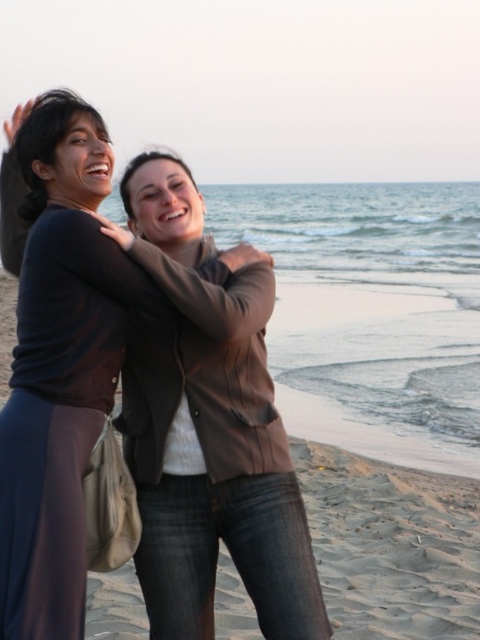
You are a photographer trying to capture a closeup of the two people in the scene. You notice the brown leather jacket at center and the matte black hair at upper left. Which object would you need to focus on first if you want to ensure both are in focus?

The brown leather jacket at center is bigger than matte black hair at upper left, so you should focus on the brown leather jacket at center first to ensure both are in focus.

You are a photographer trying to capture a photo of the matte brown jacket at center and the matte black hair at upper left. Based on their sizes in the image, which object should you focus on first to ensure it appears larger in the photo?

The matte brown jacket at center is taller than the matte black hair at upper left, so you should focus on the matte brown jacket at center first to ensure it appears larger in the photo.

You are a photographer trying to capture a photo of the two people in the scene. You want to ensure that the brown leather jacket at center and the matte black hair at upper left are both in focus. Which object should you position your camera closer to in order to focus on both?

The brown leather jacket at center is to the right of matte black hair at upper left. To focus on both, position the camera closer to the matte black hair at upper left so that the brown leather jacket at center remains within the focus range to the right.